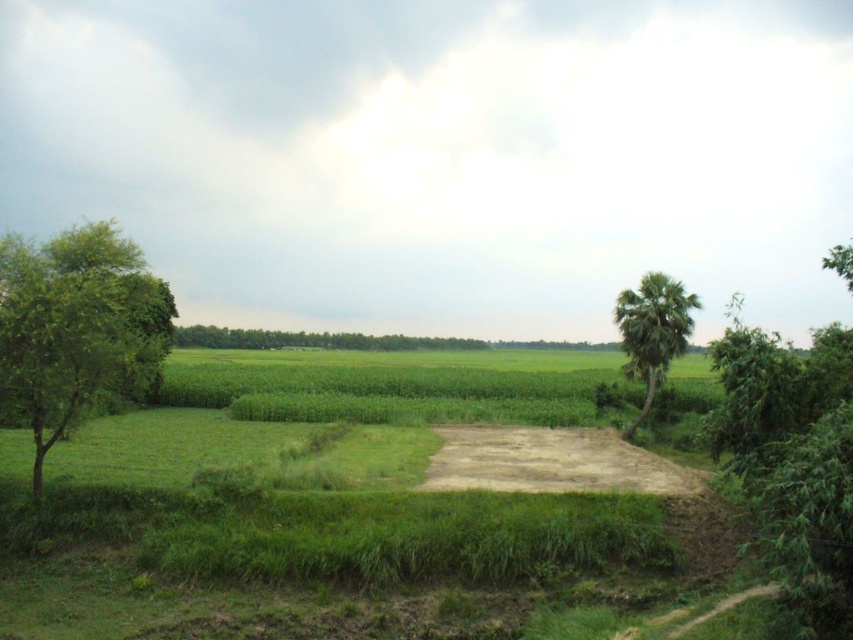
Question: Can you confirm if green leafy tree at left is bigger than brown sandy dirt track at center?

Choices:
 (A) yes
 (B) no

Answer: (A)

Question: Can you confirm if green leafy tree at right is thinner than green leafy tree at left?

Choices:
 (A) no
 (B) yes

Answer: (A)

Question: Is brown sandy dirt track at center bigger than green leafy palm at right?

Choices:
 (A) yes
 (B) no

Answer: (B)

Question: Which of the following is the farthest from the observer?

Choices:
 (A) (85, 316)
 (B) (521, 474)
 (C) (453, 346)
 (D) (659, 362)

Answer: (C)

Question: Which point is closer to the camera?

Choices:
 (A) (608, 346)
 (B) (120, 381)
 (C) (788, 556)

Answer: (C)

Question: Estimate the real-world distances between objects in this image. Which object is farther from the brown sandy dirt track at center?

Choices:
 (A) green leafy tree at center
 (B) green leafy palm at right
 (C) green leafy tree at right

Answer: (A)